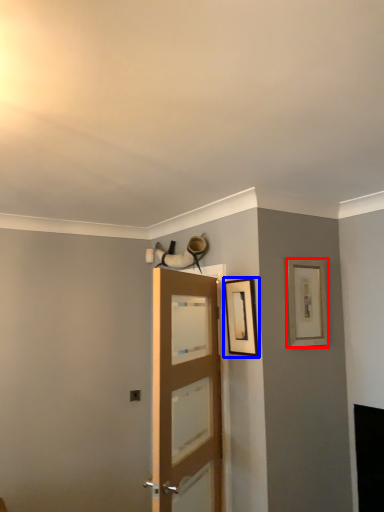
Question: Which object is further to the camera taking this photo, picture frame (highlighted by a red box) or picture frame (highlighted by a blue box)?

Choices:
 (A) picture frame
 (B) picture frame

Answer: (A)